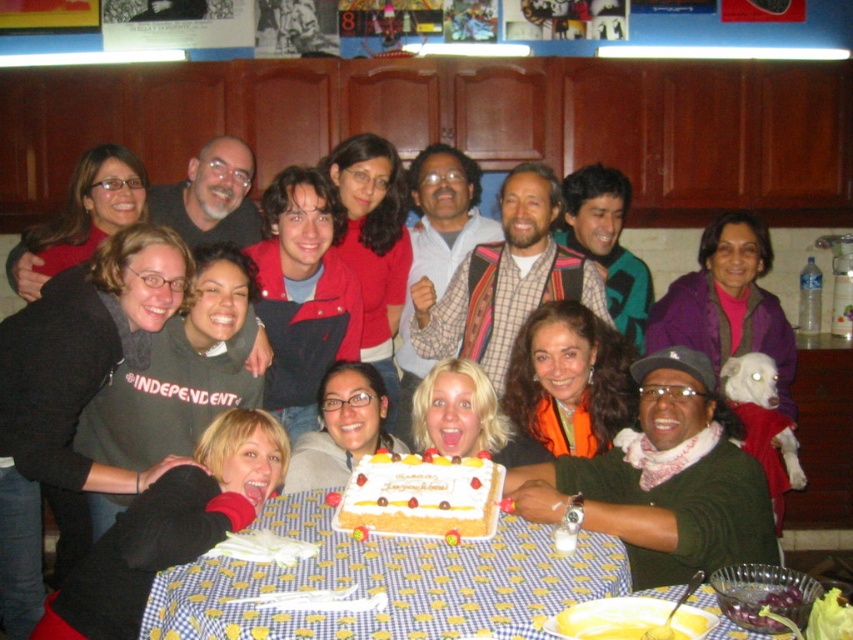
You are a guest at this gathering and want to place a small gift on the table. Considering the yellow checkered tablecloth at lower center and the white frosted cake at center, which surface is higher and thus more suitable for placing the gift where it won

The yellow checkered tablecloth at lower center is taller than the white frosted cake at center, so placing the gift on the tablecloth would be higher and more suitable.

You are planning to place a new centerpiece on the table. The current centerpiece is the white frosted cake at center. Considering the size of the yellow checkered tablecloth at lower center, can the tablecloth accommodate a larger centerpiece than the current one?

The yellow checkered tablecloth at lower center is larger in size compared to the white frosted cake at center. Therefore, the tablecloth can accommodate a larger centerpiece than the current one.

You are standing at the position of point (x=434, y=513) and want to walk towards the door located at point (x=396, y=592). Is the door in front of you?

Yes, the door located at point (x=396, y=592) is in front of you because it is positioned in front of point (x=434, y=513).